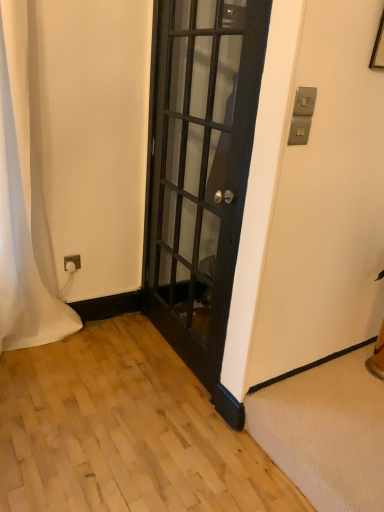
Question: Is white fabric curtain at left located outside black glass door at center?

Choices:
 (A) yes
 (B) no

Answer: (A)

Question: Does white fabric curtain at left contain black glass door at center?

Choices:
 (A) no
 (B) yes

Answer: (A)

Question: Is white fabric curtain at left turned away from black glass door at center?

Choices:
 (A) yes
 (B) no

Answer: (B)

Question: From a real-world perspective, is white fabric curtain at left beneath black glass door at center?

Choices:
 (A) yes
 (B) no

Answer: (A)

Question: Can you confirm if white fabric curtain at left is positioned to the left of black glass door at center?

Choices:
 (A) yes
 (B) no

Answer: (A)

Question: Does white fabric curtain at left come in front of black glass door at center?

Choices:
 (A) no
 (B) yes

Answer: (A)

Question: From a real-world perspective, is black glass door at center over white fabric curtain at left?

Choices:
 (A) no
 (B) yes

Answer: (B)

Question: Would you say black glass door at center contains white fabric curtain at left?

Choices:
 (A) yes
 (B) no

Answer: (B)

Question: Can you confirm if black glass door at center is shorter than white fabric curtain at left?

Choices:
 (A) yes
 (B) no

Answer: (B)

Question: Is black glass door at center oriented towards white fabric curtain at left?

Choices:
 (A) no
 (B) yes

Answer: (B)

Question: Is the position of black glass door at center more distant than that of white fabric curtain at left?

Choices:
 (A) no
 (B) yes

Answer: (A)

Question: Considering the relative positions of black glass door at center and white fabric curtain at left in the image provided, is black glass door at center to the right of white fabric curtain at left from the viewer's perspective?

Choices:
 (A) yes
 (B) no

Answer: (A)

Question: Looking at the image, does white fabric curtain at left seem bigger or smaller compared to black glass door at center?

Choices:
 (A) big
 (B) small

Answer: (B)